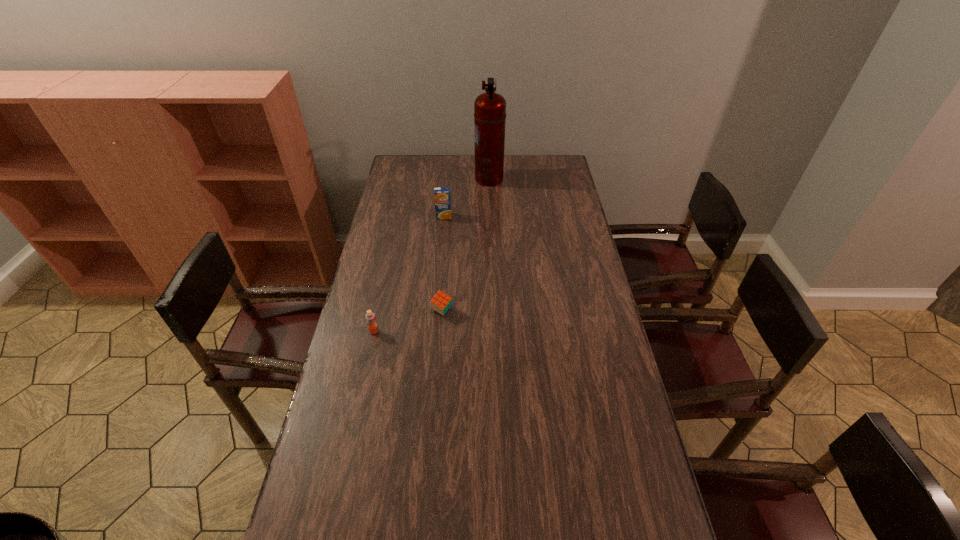
At what (x,y) coordinates should I click in order to perform the action: click on free spot between the tallest object and the left orange juice. Please return your answer as a coordinate pair (x, y). Looking at the image, I should click on (431, 255).

Choose which object is the third nearest neighbor to the farther orange juice. Please provide its 2D coordinates. Your answer should be formatted as a tuple, i.e. [(x, y)], where the tuple contains the x and y coordinates of a point satisfying the conditions above.

[(370, 317)]

Identify the location of object that is the third closest to the cube. (489, 108).

Locate an element on the screen. free point that satisfies the following two spatial constraints: 1. on the nozzle side of the farthest object; 2. on the front side of the third tallest object is located at coordinates (493, 331).

The height and width of the screenshot is (540, 960). I want to click on blank space that satisfies the following two spatial constraints: 1. on the nozzle side of the tallest object; 2. on the front side of the second nearest object, so click(492, 310).

Locate an element on the screen. This screenshot has height=540, width=960. blank space that satisfies the following two spatial constraints: 1. on the nozzle side of the farthest object; 2. on the front side of the nearer orange juice is located at coordinates (493, 331).